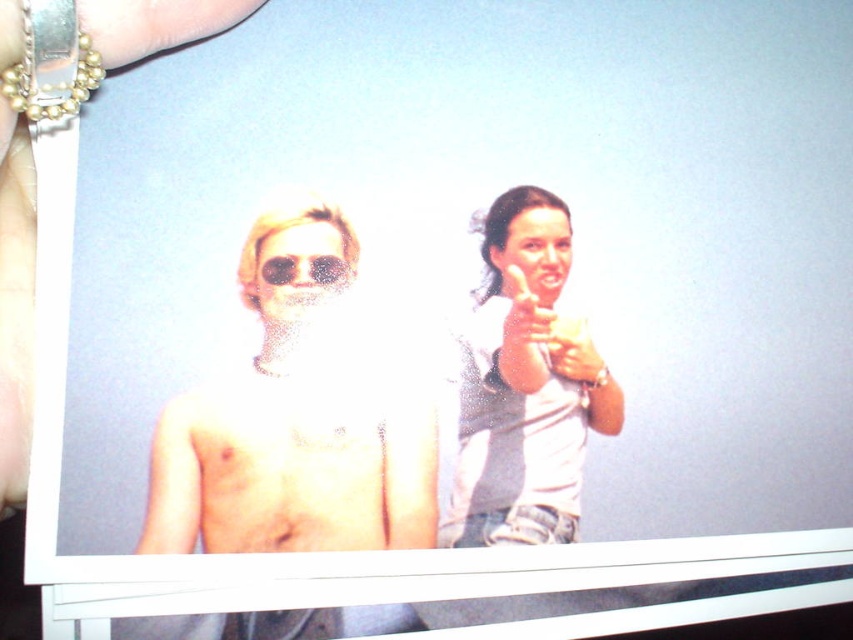
Question: Which of these objects is positioned farthest from the white matte shirt at upper right?

Choices:
 (A) matte sunglasses at center
 (B) matte plastic goggles at center

Answer: (B)

Question: Where is matte sunglasses at center located in relation to smooth skin face at upper right in the image?

Choices:
 (A) above
 (B) below

Answer: (B)

Question: Which point is farther to the camera?

Choices:
 (A) (486, 252)
 (B) (300, 369)
 (C) (314, 282)

Answer: (A)

Question: Does shiny metallic sunglasses at left appear over white matte shirt at upper right?

Choices:
 (A) yes
 (B) no

Answer: (B)

Question: Which point appears closest to the camera in this image?

Choices:
 (A) (572, 401)
 (B) (322, 291)

Answer: (B)

Question: Where is shiny metallic sunglasses at left located in relation to white matte shirt at upper right in the image?

Choices:
 (A) left
 (B) right

Answer: (A)